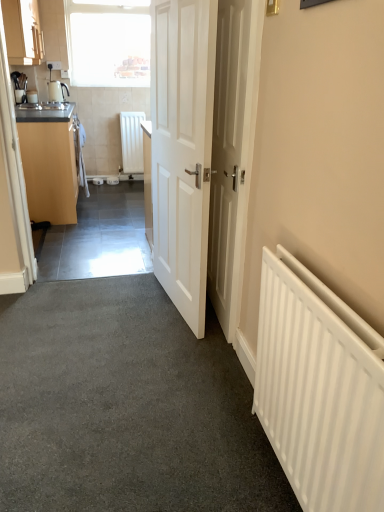
Question: Considering the relative sizes of white matte radiator at right, placed as the first radiator when sorted from front to back, and matte black sink at left in the image provided, is white matte radiator at right, placed as the first radiator when sorted from front to back, thinner than matte black sink at left?

Choices:
 (A) yes
 (B) no

Answer: (A)

Question: Is the position of white matte radiator at right, the second radiator from the top, more distant than that of matte black sink at left?

Choices:
 (A) yes
 (B) no

Answer: (B)

Question: Is matte black sink at left inside white matte radiator at right, the second radiator from the top?

Choices:
 (A) no
 (B) yes

Answer: (A)

Question: Can you confirm if white matte radiator at right, which appears as the first radiator when viewed from the right, is shorter than matte black sink at left?

Choices:
 (A) yes
 (B) no

Answer: (B)

Question: Can you confirm if white matte radiator at right, the second radiator from the top, is smaller than matte black sink at left?

Choices:
 (A) no
 (B) yes

Answer: (A)

Question: Can you confirm if white matte radiator at right, the second radiator viewed from the back, is positioned to the left of matte black sink at left?

Choices:
 (A) no
 (B) yes

Answer: (A)

Question: From the image's perspective, is white matte radiator at center, the first radiator in the left-to-right sequence, above matte wood cabinet at left, which appears as the 2th cabinetry when viewed from the top?

Choices:
 (A) yes
 (B) no

Answer: (A)

Question: From the image's perspective, does white matte radiator at center, the 2th radiator positioned from the bottom, appear lower than matte wood cabinet at left, which appears as the 2th cabinetry when viewed from the top?

Choices:
 (A) yes
 (B) no

Answer: (B)

Question: Is white matte radiator at center, the 2th radiator positioned from the bottom, positioned far away from matte wood cabinet at left, which appears as the 2th cabinetry when viewed from the top?

Choices:
 (A) no
 (B) yes

Answer: (B)

Question: Is the depth of white matte radiator at center, which is the 2th radiator in right-to-left order, greater than that of matte wood cabinet at left, acting as the 1th cabinetry starting from the bottom?

Choices:
 (A) no
 (B) yes

Answer: (B)

Question: Can you confirm if white matte radiator at center, which is the first radiator in back-to-front order, is smaller than matte wood cabinet at left, acting as the 1th cabinetry starting from the bottom?

Choices:
 (A) yes
 (B) no

Answer: (A)

Question: Can you confirm if white matte radiator at center, the second radiator viewed from the front, is taller than matte wood cabinet at left, which appears as the 2th cabinetry when viewed from the top?

Choices:
 (A) yes
 (B) no

Answer: (B)

Question: Does white matte door at center, which is the first door in right-to-left order, contain white matte radiator at right, the 1th radiator in the bottom-to-top sequence?

Choices:
 (A) yes
 (B) no

Answer: (B)